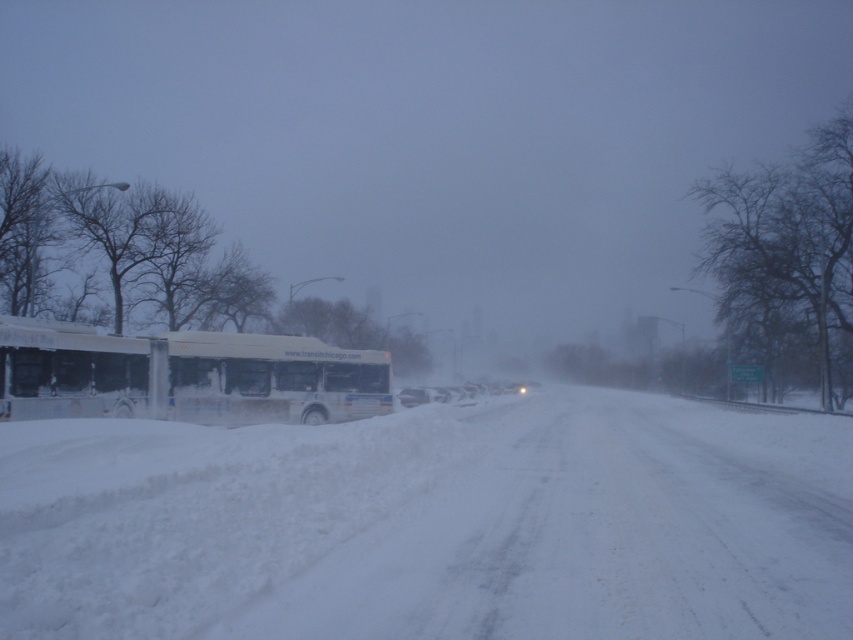
Question: Among these objects, which one is farthest from the camera?

Choices:
 (A) white fluffy snow at center
 (B) white matte bus at left

Answer: (B)

Question: Is white fluffy snow at center to the right of white matte bus at left from the viewer's perspective?

Choices:
 (A) no
 (B) yes

Answer: (B)

Question: Is white fluffy snow at center smaller than white matte bus at left?

Choices:
 (A) no
 (B) yes

Answer: (A)

Question: Which point is closer to the camera taking this photo?

Choices:
 (A) (384, 365)
 (B) (259, 432)

Answer: (B)

Question: Which point is farther from the camera taking this photo?

Choices:
 (A) (285, 339)
 (B) (306, 628)

Answer: (A)

Question: Does white fluffy snow at center have a smaller size compared to white matte bus at left?

Choices:
 (A) yes
 (B) no

Answer: (B)